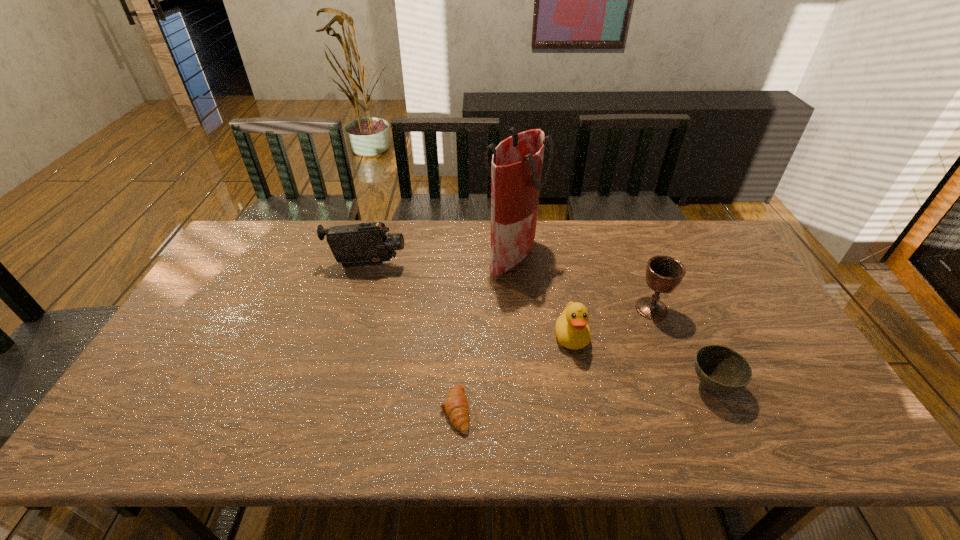
This screenshot has height=540, width=960. What are the coordinates of `the tallest object` in the screenshot? It's located at (516, 170).

Where is `the leftmost object`? This screenshot has height=540, width=960. the leftmost object is located at coordinates (363, 244).

Find the location of `chalice`. chalice is located at coordinates (663, 273).

At what (x,y) coordinates should I click in order to perform the action: click on the fourth tallest object. Please return your answer as a coordinate pair (x, y). The image size is (960, 540). Looking at the image, I should click on (572, 331).

Where is `bowl`? The height and width of the screenshot is (540, 960). bowl is located at coordinates (721, 370).

At what (x,y) coordinates should I click in order to perform the action: click on the second object from left to right. Please return your answer as a coordinate pair (x, y). Image resolution: width=960 pixels, height=540 pixels. Looking at the image, I should click on (456, 406).

At what (x,y) coordinates should I click in order to perform the action: click on the shortest object. Please return your answer as a coordinate pair (x, y). This screenshot has height=540, width=960. Looking at the image, I should click on (456, 406).

You are a GUI agent. You are given a task and a screenshot of the screen. Output one action in this format:
    pyautogui.click(x=<x>, y=<y>)
    Task: Click on the vacant area located 0.110m on the front of the grocery bag
    
    Given the screenshot: What is the action you would take?
    pyautogui.click(x=517, y=306)

This screenshot has height=540, width=960. I want to click on blank space located on the front-facing side of the leftmost object, so click(x=428, y=265).

Identify the location of vacant area situated 0.360m on the left of the chalice. (512, 309).